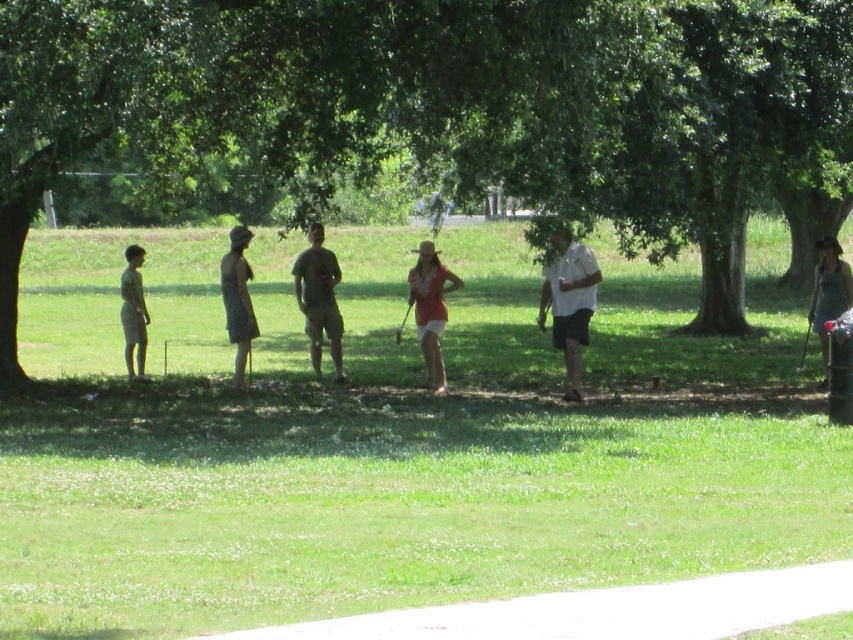
Describe the element at coordinates (569, 301) in the screenshot. The width and height of the screenshot is (853, 640). I see `white matte shirt at center` at that location.

Locate an element on the screen. white matte shirt at center is located at coordinates (569, 301).

Between green grass at center and white matte shirt at center, which one is positioned lower?

Positioned lower is white matte shirt at center.

Who is taller, green grass at center or white matte shirt at center?

With more height is green grass at center.

Is point (432, 404) in front of point (572, 298)?

That is True.

The width and height of the screenshot is (853, 640). What are the coordinates of `green grass at center` in the screenshot? It's located at (392, 442).

Who is more distant from viewer, (334, 266) or (814, 282)?

The point (814, 282) is behind.

Who is positioned more to the right, camouflage t-shirt at center or denim dress at right?

denim dress at right

The width and height of the screenshot is (853, 640). Identify the location of camouflage t-shirt at center. (318, 300).